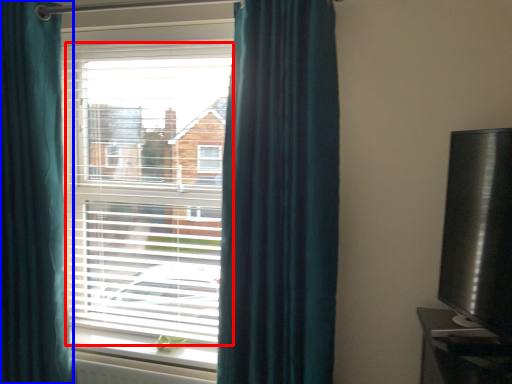
Question: Which point is closer to the camera, bay window (highlighted by a red box) or curtain (highlighted by a blue box)?

Choices:
 (A) bay window
 (B) curtain

Answer: (B)